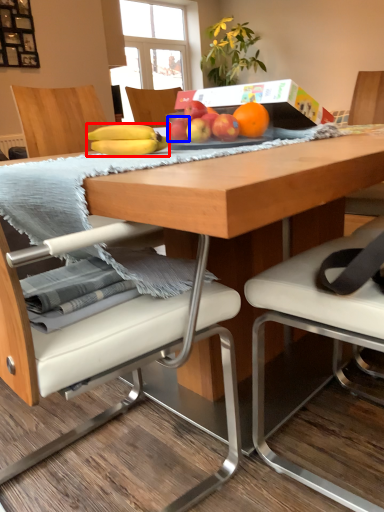
Question: Which object is closer to the camera taking this photo, banana (highlighted by a red box) or apple (highlighted by a blue box)?

Choices:
 (A) banana
 (B) apple

Answer: (A)